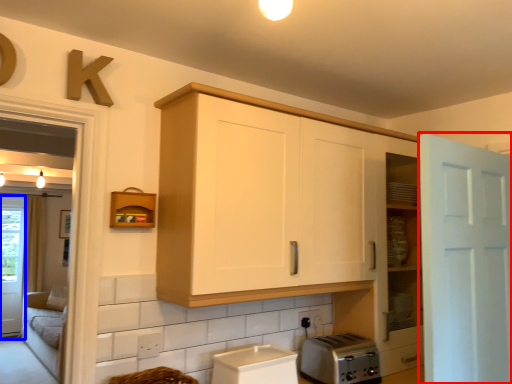
Question: Which object appears closest to the camera in this image, door (highlighted by a red box) or screen door (highlighted by a blue box)?

Choices:
 (A) door
 (B) screen door

Answer: (A)